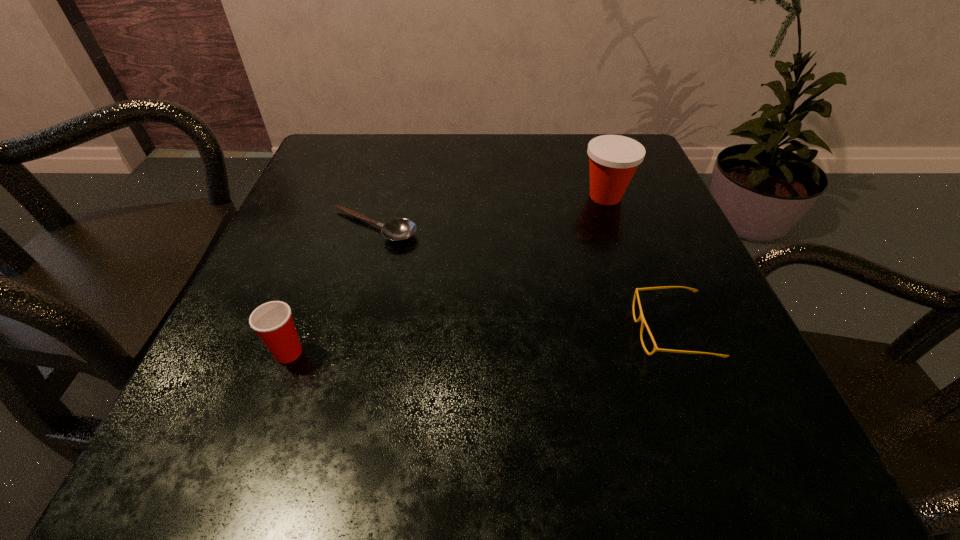
Image resolution: width=960 pixels, height=540 pixels. I want to click on vacant space located 0.200m in front of the lenses of the spectacles, so click(499, 332).

This screenshot has width=960, height=540. Find the location of `free space located 0.150m on the front of the ladle`. free space located 0.150m on the front of the ladle is located at coordinates coord(350,313).

The width and height of the screenshot is (960, 540). I want to click on object that is positioned at the far edge, so click(613, 159).

The image size is (960, 540). What are the coordinates of `Dixie cup that is at the left edge` in the screenshot? It's located at (272, 321).

Locate an element on the screen. Image resolution: width=960 pixels, height=540 pixels. ladle located in the left edge section of the desktop is located at coordinates (400, 229).

Where is `Dixie cup that is at the right edge`? Image resolution: width=960 pixels, height=540 pixels. Dixie cup that is at the right edge is located at coordinates (613, 159).

Where is `spectacles that is at the right edge`? This screenshot has width=960, height=540. spectacles that is at the right edge is located at coordinates (641, 318).

Find the location of a particular element. Image resolution: width=960 pixels, height=540 pixels. object that is at the far right corner is located at coordinates (613, 159).

The image size is (960, 540). In the image, there is a desktop. Identify the location of vacant space at the far edge. (565, 140).

Locate an element on the screen. free space at the near edge of the desktop is located at coordinates (422, 458).